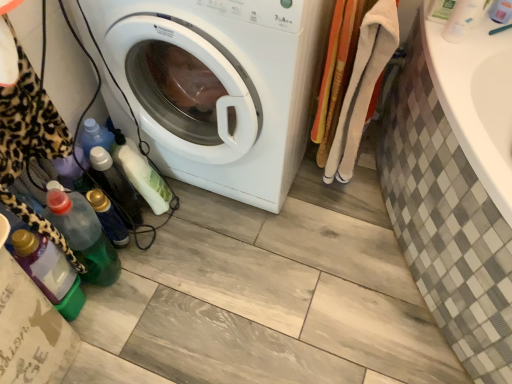
Question: Considering the relative positions of white glossy washing machine at center and translucent plastic bottle at lower left, the fourth bottle from the right, in the image provided, is white glossy washing machine at center to the left or to the right of translucent plastic bottle at lower left, the fourth bottle from the right,?

Choices:
 (A) right
 (B) left

Answer: (A)

Question: Is point (178, 16) closer or farther from the camera than point (123, 220)?

Choices:
 (A) farther
 (B) closer

Answer: (B)

Question: Considering the real-world distances, which object is closest to the translucent plastic bottle at lower left, the third bottle in the right-to-left sequence?

Choices:
 (A) white glossy washing machine at center
 (B) green matte bottle at upper right, the 6th bottle viewed from the left
 (C) translucent plastic bottle at lower left, the fifth bottle when ordered from right to left
 (D) white matte bottle at upper right, acting as the 7th bottle starting from the left
 (E) soft cotton towels at right

Answer: (C)

Question: Based on their relative distances, which object is farther from the translucent plastic bottle at lower left, the 7th bottle positioned from the right?

Choices:
 (A) translucent plastic bottle at lower left, which ranks as the fifth bottle in left-to-right order
 (B) translucent plastic bottle at lower left, the fifth bottle when ordered from right to left
 (C) green matte bottle at upper right, which appears as the second bottle when viewed from the right
 (D) white glossy washing machine at center
 (E) white plastic bottle at upper right

Answer: (E)